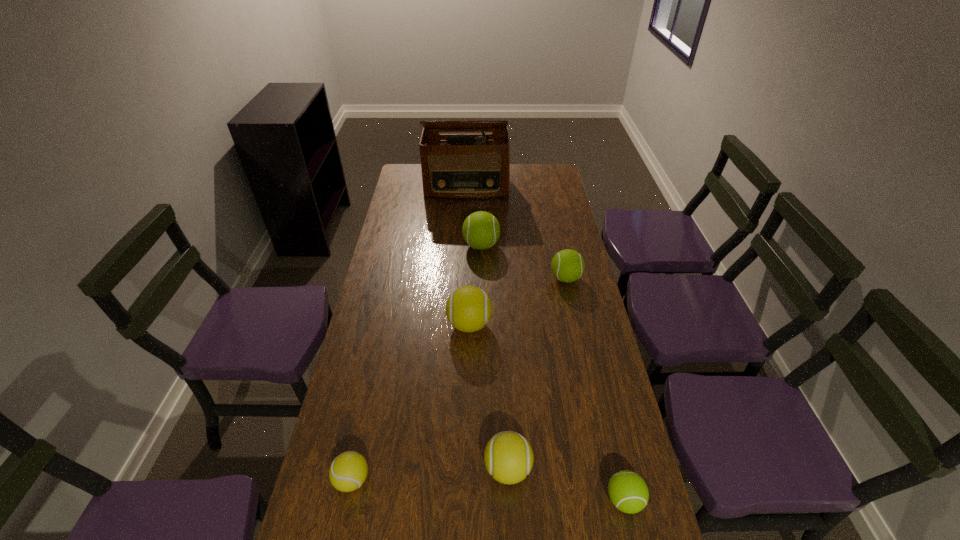
You are a GUI agent. You are given a task and a screenshot of the screen. Output one action in this format:
    pyautogui.click(x=<x>, y=<y>)
    Task: Click on the leftmost yellow tennis ball
    This screenshot has height=540, width=960.
    Given the screenshot: What is the action you would take?
    pyautogui.click(x=348, y=471)

You are a GUI agent. You are given a task and a screenshot of the screen. Output one action in this format:
    pyautogui.click(x=<x>, y=<y>)
    Task: Click on the smallest green tennis ball
    The image size is (960, 540).
    Given the screenshot: What is the action you would take?
    click(628, 492)

You are a GUI agent. You are given a task and a screenshot of the screen. Output one action in this format:
    pyautogui.click(x=<x>, y=<y>)
    Task: Click on the vacant space situated on the front panel of the tallest object
    This screenshot has width=960, height=540.
    Given the screenshot: What is the action you would take?
    pyautogui.click(x=465, y=243)

Identify the location of free space located 0.300m on the right of the farthest tennis ball. [x=574, y=246].

The width and height of the screenshot is (960, 540). What are the coordinates of `free spot located on the front of the biggest yellow tennis ball` in the screenshot? It's located at (466, 462).

Locate an element on the screen. free region located on the left of the fifth nearest tennis ball is located at coordinates (482, 278).

Where is `free spot located on the left of the second smallest yellow tennis ball`? The width and height of the screenshot is (960, 540). free spot located on the left of the second smallest yellow tennis ball is located at coordinates (392, 469).

Find the location of a particular element. This screenshot has width=960, height=540. vacant position located 0.220m on the back of the leftmost yellow tennis ball is located at coordinates (372, 388).

Locate an element on the screen. vacant space located on the back of the nearest green tennis ball is located at coordinates (600, 396).

Where is `object situated at the far edge`? Image resolution: width=960 pixels, height=540 pixels. object situated at the far edge is located at coordinates (454, 166).